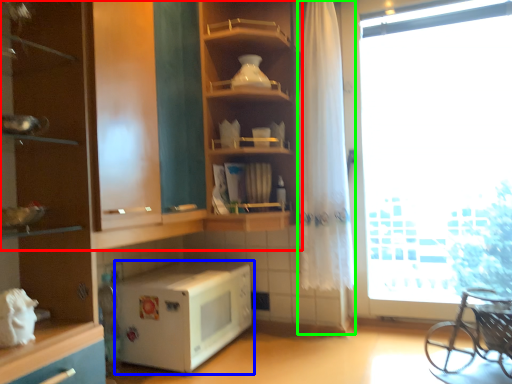
Question: Estimate the real-world distances between objects in this image. Which object is closer to shelf (highlighted by a red box), microwave oven (highlighted by a blue box) or curtain (highlighted by a green box)?

Choices:
 (A) microwave oven
 (B) curtain

Answer: (A)